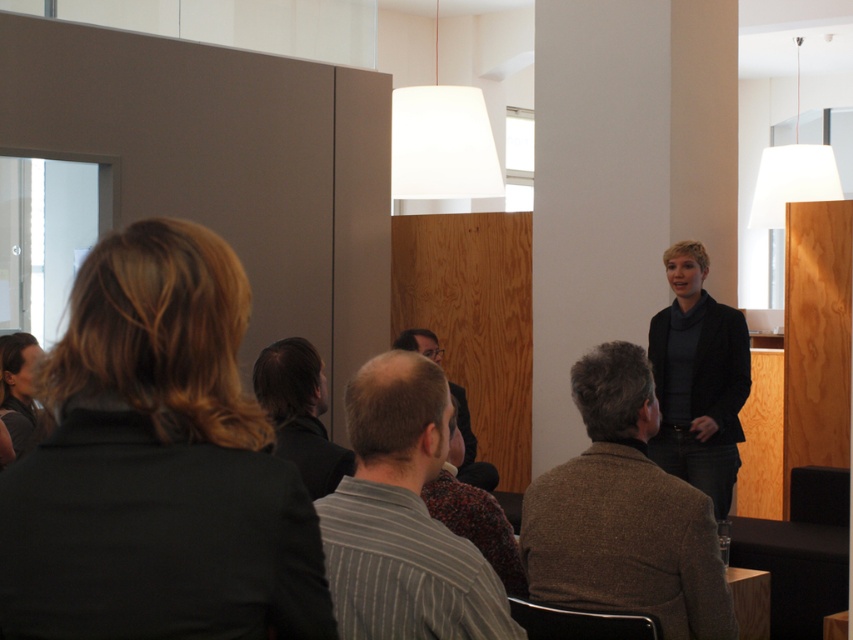
You are organizing a photo shoot and need to arrange two sweaters in a display case. The display case has a height limit of 1 meter. Given that the brown woolen sweater at center is not as tall as the dark gray sweater at center, will both sweaters fit vertically in the display case?

Both the brown woolen sweater at center and the dark gray sweater at center will fit vertically in the display case since the tallest sweater, the dark gray sweater at center, is shorter than the 1 meter height limit.

You are sitting in the back row of the room and want to hand a document to the person wearing the striped cotton shirt at center and the dark gray sweater at center. Which one is closer to you?

The striped cotton shirt at center is closer to the viewer than the dark gray sweater at center, so the striped cotton shirt at center is closer to you.